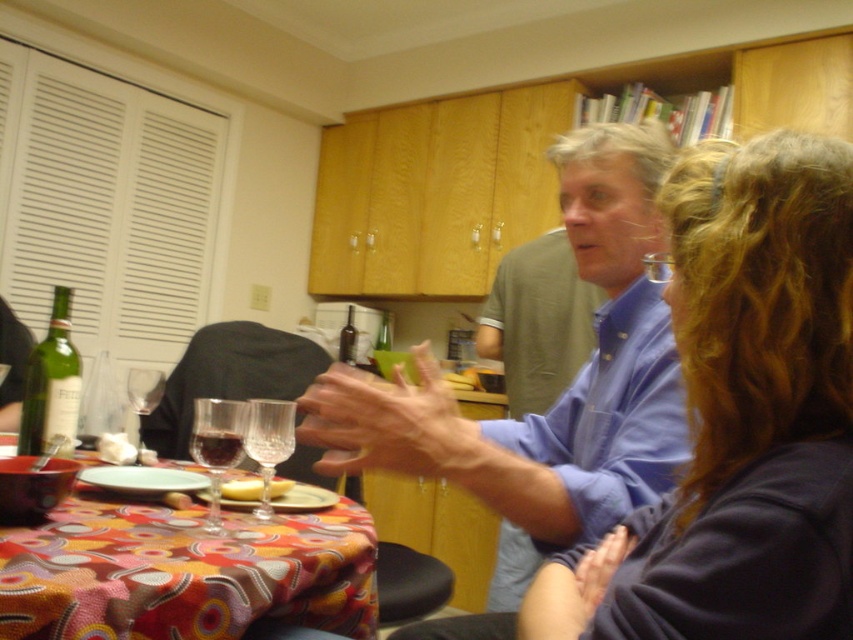
Is green glass bottle at table left further to camera compared to yellow soft bread at table?

Yes, green glass bottle at table left is further from the viewer.

Is green glass bottle at table left to the right of yellow soft bread at table from the viewer's perspective?

Incorrect, green glass bottle at table left is not on the right side of yellow soft bread at table.

This screenshot has height=640, width=853. What do you see at coordinates (51, 385) in the screenshot?
I see `green glass bottle at table left` at bounding box center [51, 385].

Find the location of `green glass bottle at table left`. green glass bottle at table left is located at coordinates (51, 385).

Can you confirm if green glass bottle at table left is thinner than translucent glass wine glass at table center?

In fact, green glass bottle at table left might be wider than translucent glass wine glass at table center.

Can you confirm if green glass bottle at table left is wider than translucent glass wine glass at table center?

Indeed, green glass bottle at table left has a greater width compared to translucent glass wine glass at table center.

You are a GUI agent. You are given a task and a screenshot of the screen. Output one action in this format:
    pyautogui.click(x=<x>, y=<y>)
    Task: Click on the green glass bottle at table left
    The image size is (853, 640).
    Given the screenshot: What is the action you would take?
    pyautogui.click(x=51, y=385)

Which is more to the left, translucent glass wine glass at table center or dark red liquid at table front?

translucent glass wine glass at table center

Between point (219, 499) and point (204, 464), which one is positioned behind?

The point (204, 464) is more distant.

Where is `translucent glass wine glass at table center`? The width and height of the screenshot is (853, 640). translucent glass wine glass at table center is located at coordinates (218, 448).